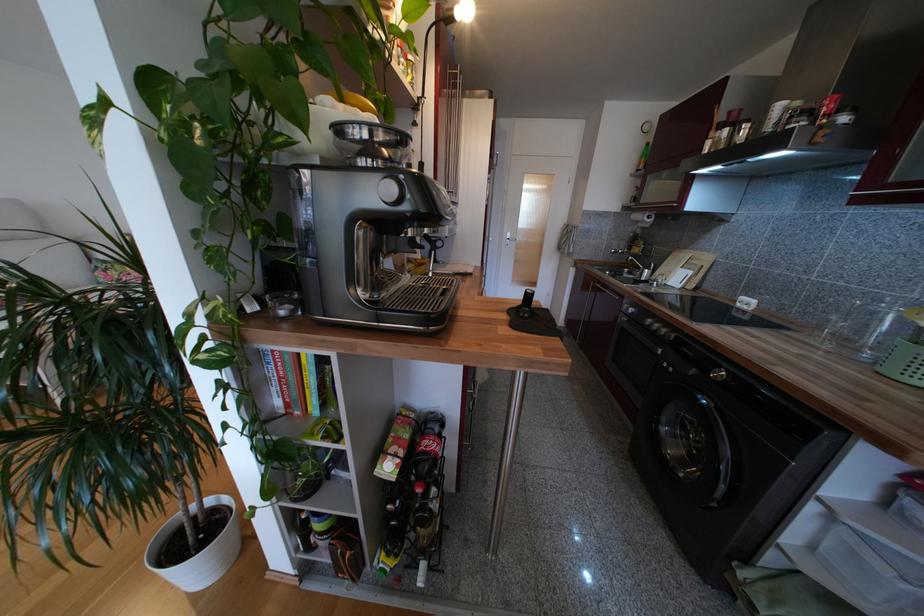
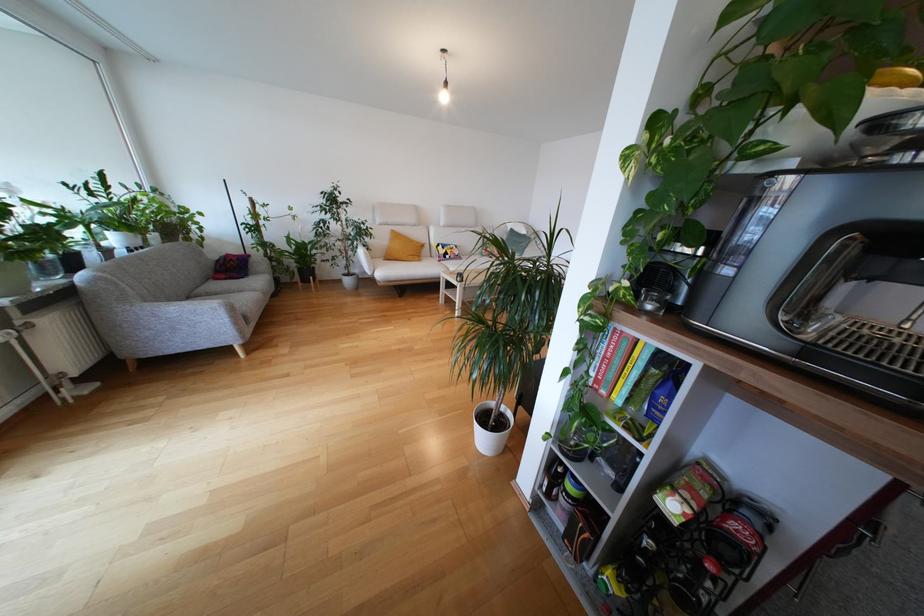
Find the pixel in the second image that matches [204,540] in the first image.

(497, 427)